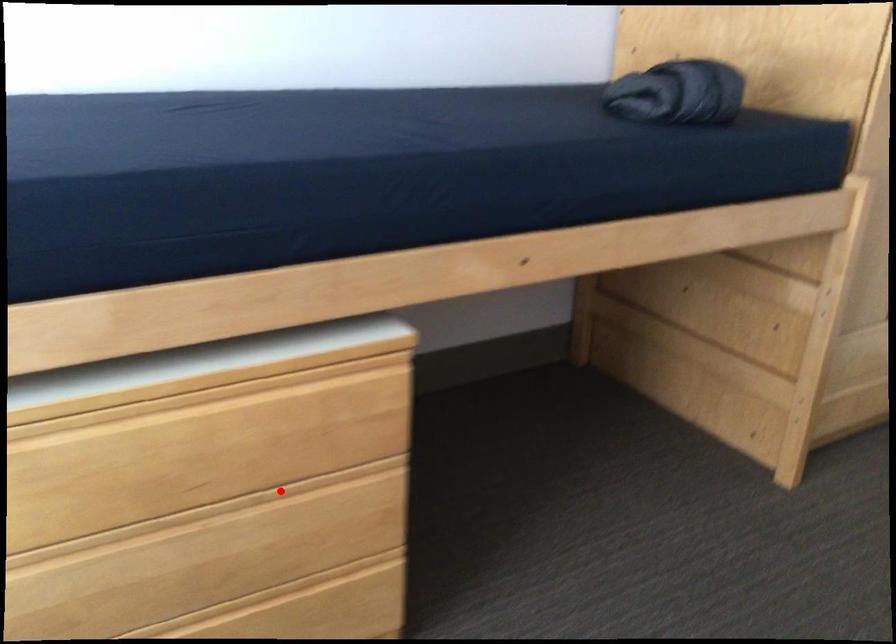
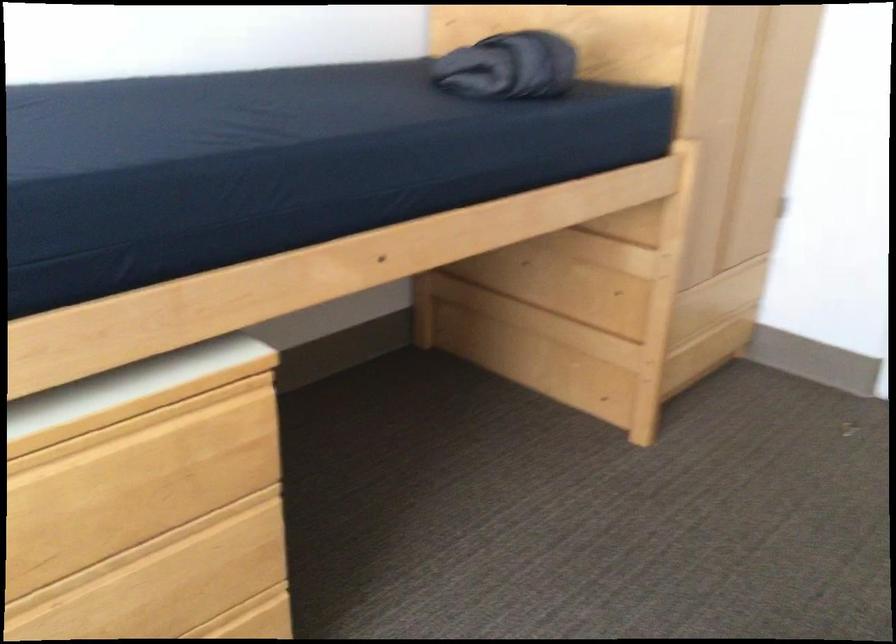
Question: A red point is marked in image1. In image2, is the corresponding 3D point closer to the camera or farther? Reply with the corresponding letter.

Choices:
 (A) The corresponding 3D point is closer.
 (B) The corresponding 3D point is farther.

Answer: (A)